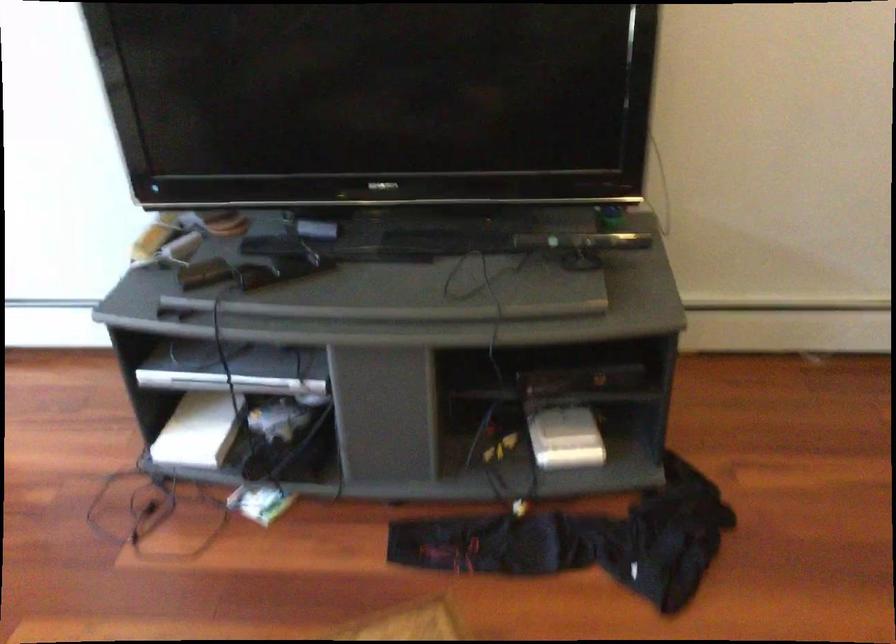
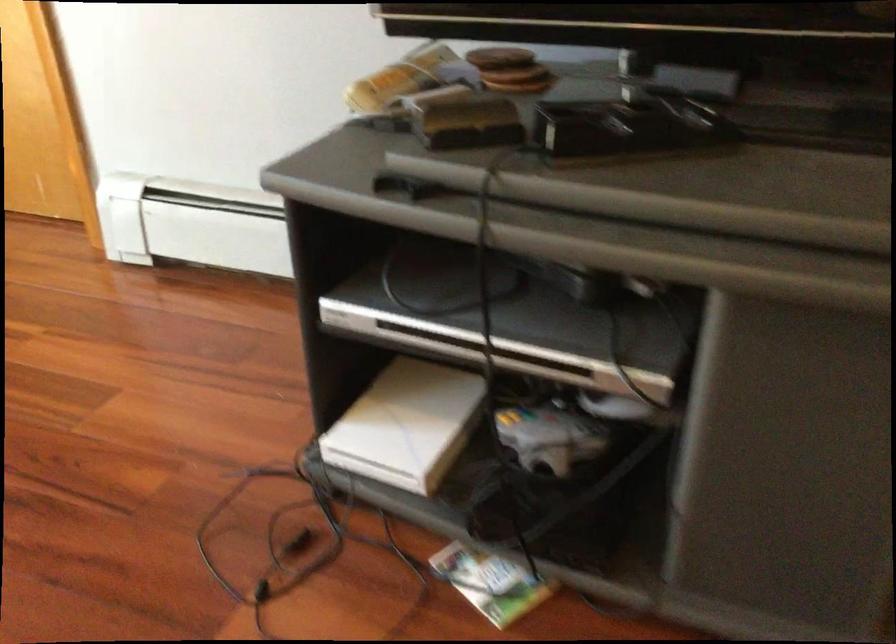
Locate, in the second image, the point that corresponds to (x=209, y=211) in the first image.

(500, 58)